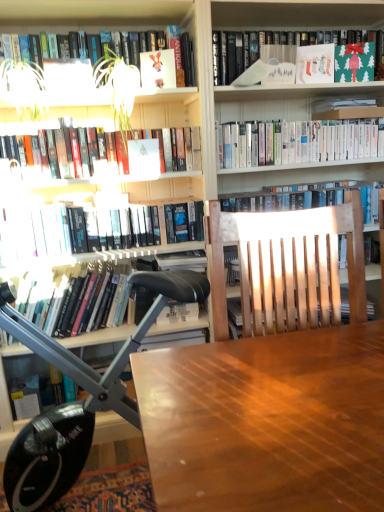
Question: In terms of width, does green paper bag at upper right, marked as the 1th book in a top-to-bottom arrangement, look wider or thinner when compared to green leafy plant at upper left?

Choices:
 (A) thin
 (B) wide

Answer: (A)

Question: Visually, is green paper bag at upper right, marked as the 1th book in a top-to-bottom arrangement, positioned to the left or to the right of green leafy plant at upper left?

Choices:
 (A) right
 (B) left

Answer: (A)

Question: Based on their relative distances, which object is nearer to the hardcover books at upper left, placed as the fourth book when sorted from bottom to top?

Choices:
 (A) white glossy bookshelf at upper center, the 3th book viewed from the top
 (B) green leafy plant at upper left
 (C) wooden table at center
 (D) white paper at upper left, which ranks as the second book in bottom-to-top order
 (E) green matte paper at upper right, which is the 4th paperback book from left to right

Answer: (B)

Question: Which of these objects is positioned closest to the white paper at upper left, acting as the sixth book starting from the top?

Choices:
 (A) matte paper stocking at upper right, marked as the 3th paperback book in a left-to-right arrangement
 (B) matte white book at upper center, arranged as the first paperback book when viewed from the left
 (C) black leather chair at left
 (D) wooden table at center
 (E) green leafy plant at upper left

Answer: (E)